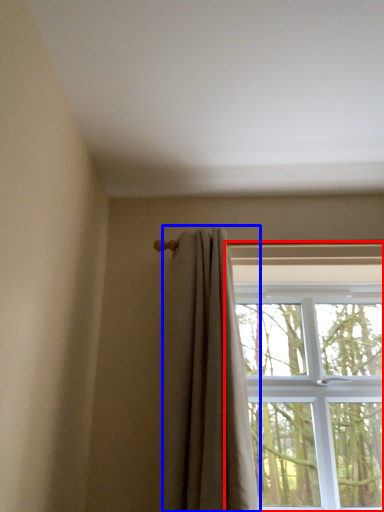
Question: Which object appears farthest to the camera in this image, window (highlighted by a red box) or curtain (highlighted by a blue box)?

Choices:
 (A) window
 (B) curtain

Answer: (A)